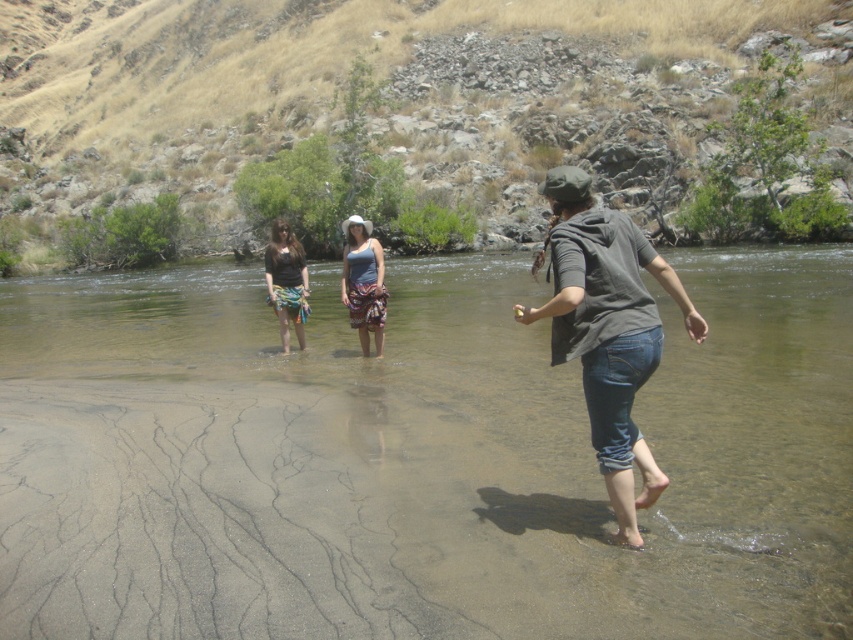
You are a photographer positioned on the riverbank. You want to capture a photo of the clear sand river at center and the blue cotton tank top at center. Which object should you focus on first to ensure it appears sharp in the photo?

The clear sand river at center is in front of the blue cotton tank top at center, so you should focus on the clear sand river at center first to ensure it appears sharp in the photo.